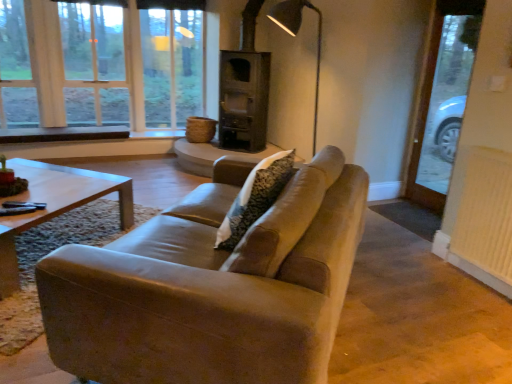
Image resolution: width=512 pixels, height=384 pixels. What are the coordinates of `vacant space in white textured radiator at right (from a real-world perspective)` in the screenshot? It's located at (467, 273).